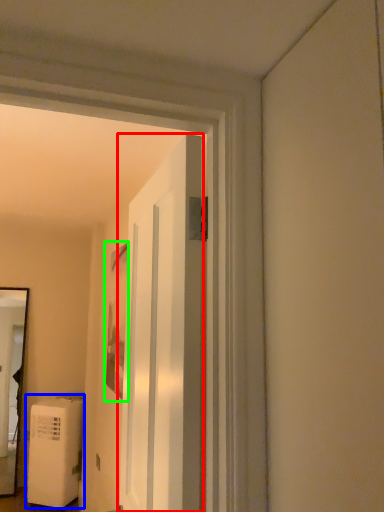
Question: Considering the real-world distances, which object is closest to door (highlighted by a red box)? water heater (highlighted by a blue box) or picture frame (highlighted by a green box).

Choices:
 (A) water heater
 (B) picture frame

Answer: (B)